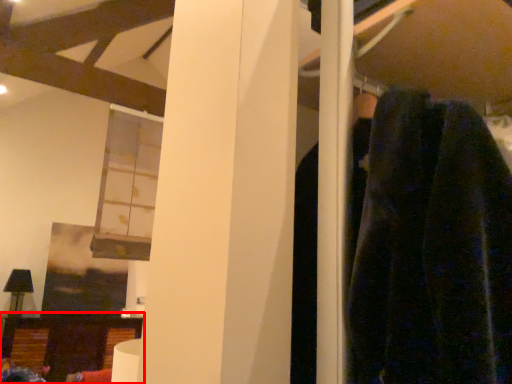
Question: From the image, what is the correct spatial relationship of furniture (annotated by the red box) in relation to window?

Choices:
 (A) left
 (B) right

Answer: (A)